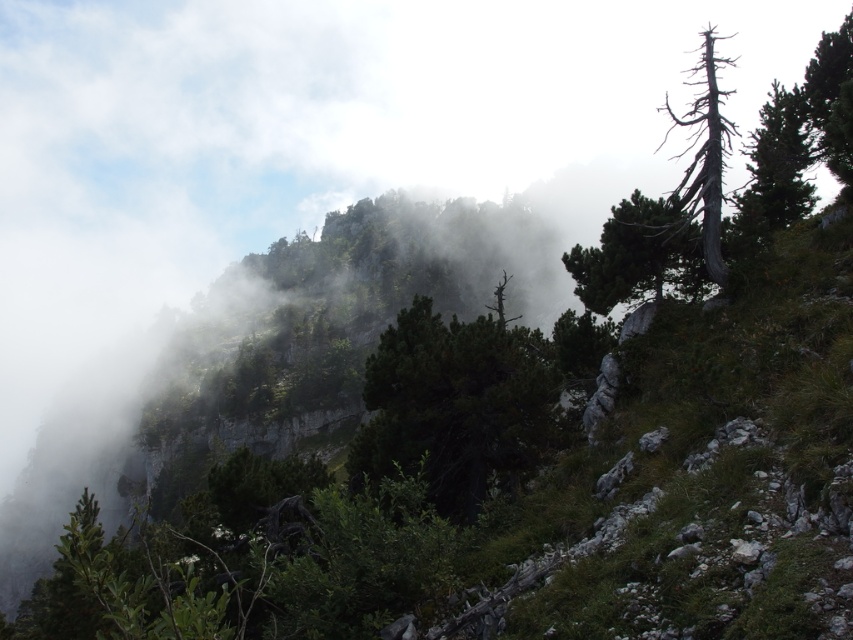
Does green matte tree at center come in front of green textured pine tree at upper right?

That is True.

Who is lower down, green matte tree at center or green textured pine tree at upper right?

green matte tree at center is below.

In order to click on green matte tree at center in this screenshot , I will do `click(454, 404)`.

Image resolution: width=853 pixels, height=640 pixels. What are the coordinates of `green matte tree at center` in the screenshot? It's located at (454, 404).

Which is more to the left, green matte tree at center or charcoal gray bark tree at upper right?

Positioned to the left is green matte tree at center.

Which is below, green matte tree at center or charcoal gray bark tree at upper right?

green matte tree at center is lower down.

The image size is (853, 640). I want to click on green matte tree at center, so click(x=454, y=404).

This screenshot has height=640, width=853. Identify the location of green matte tree at center. (454, 404).

Can you confirm if green textured pine tree at upper right is positioned to the left of charcoal gray bark tree at upper right?

No, green textured pine tree at upper right is not to the left of charcoal gray bark tree at upper right.

Find the location of `green textured pine tree at upper right`. green textured pine tree at upper right is located at coordinates (x=775, y=172).